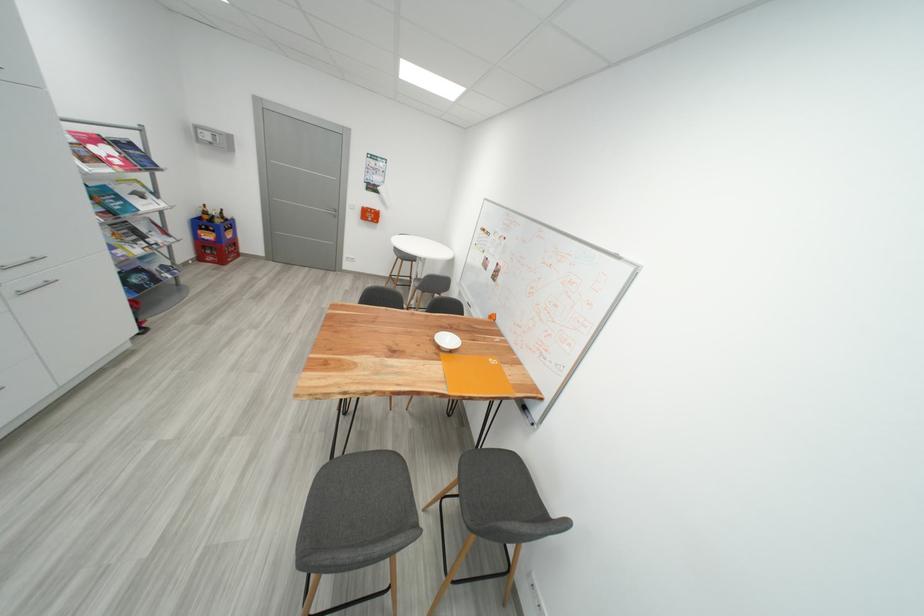
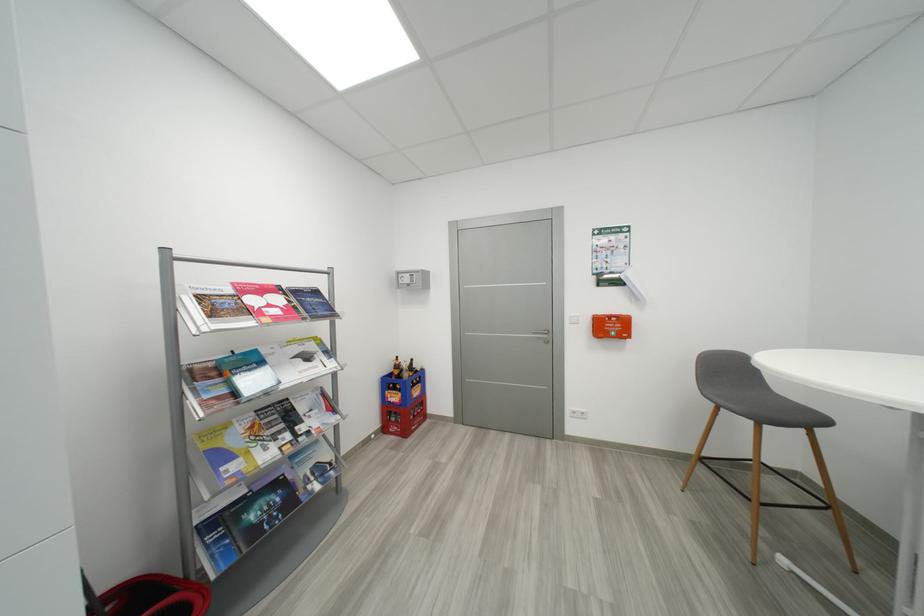
The point at (208, 220) is marked in the first image. Where is the corresponding point in the second image?

(397, 377)